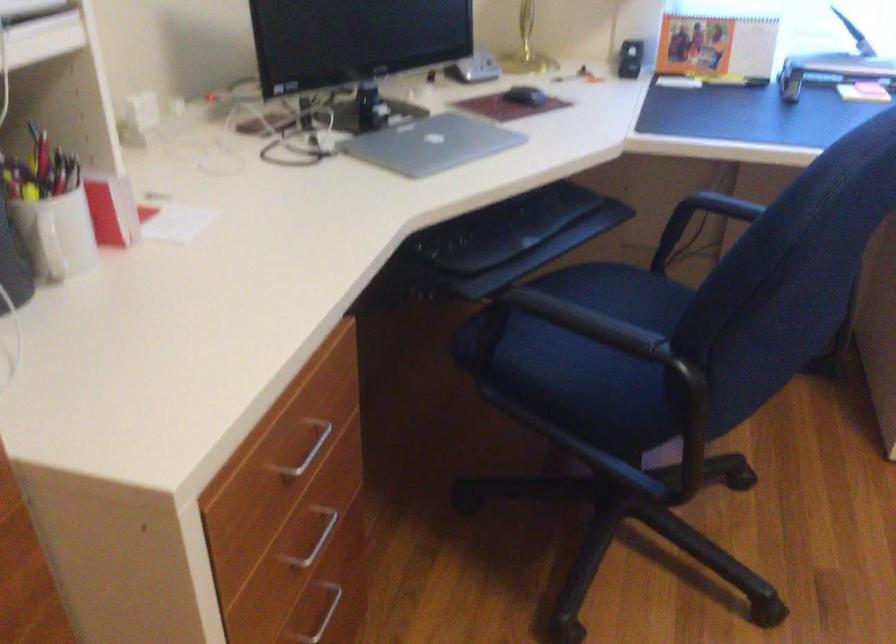
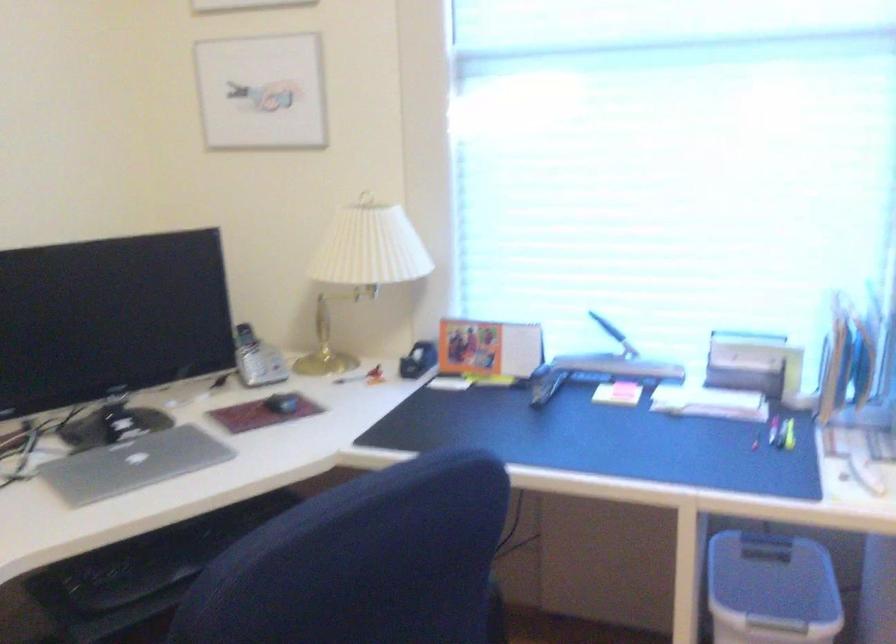
Question: Based on the continuous images, in which direction is the camera rotating? Reply with the corresponding letter.

Choices:
 (A) Left
 (B) Right
 (C) Up
 (D) Down

Answer: (C)